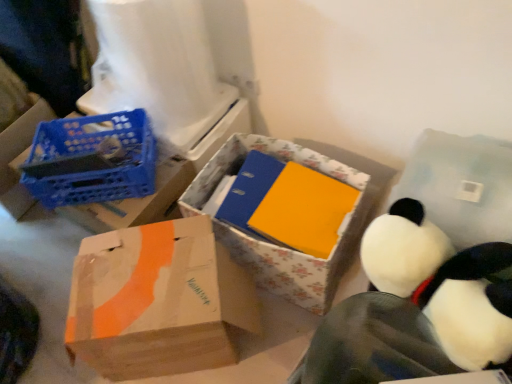
The height and width of the screenshot is (384, 512). What are the coordinates of `free space above brown cardboard box at lower left, positioned as the second box in left-to-right order (from a real-world perspective)` in the screenshot? It's located at (158, 248).